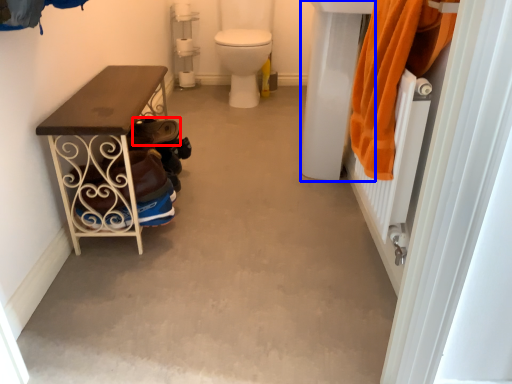
Question: Which of the following is the closest to the observer, shoe (highlighted by a red box) or sink (highlighted by a blue box)?

Choices:
 (A) shoe
 (B) sink

Answer: (B)